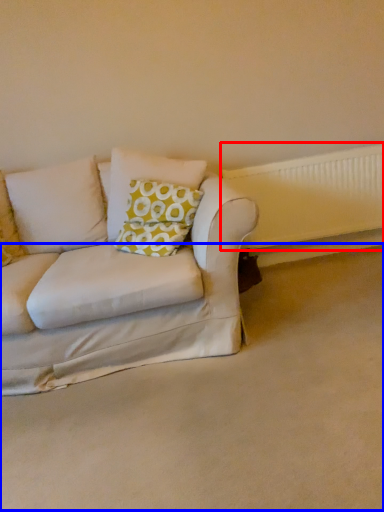
Question: Which object appears closest to the camera in this image, radiator (highlighted by a red box) or plain (highlighted by a blue box)?

Choices:
 (A) radiator
 (B) plain

Answer: (B)